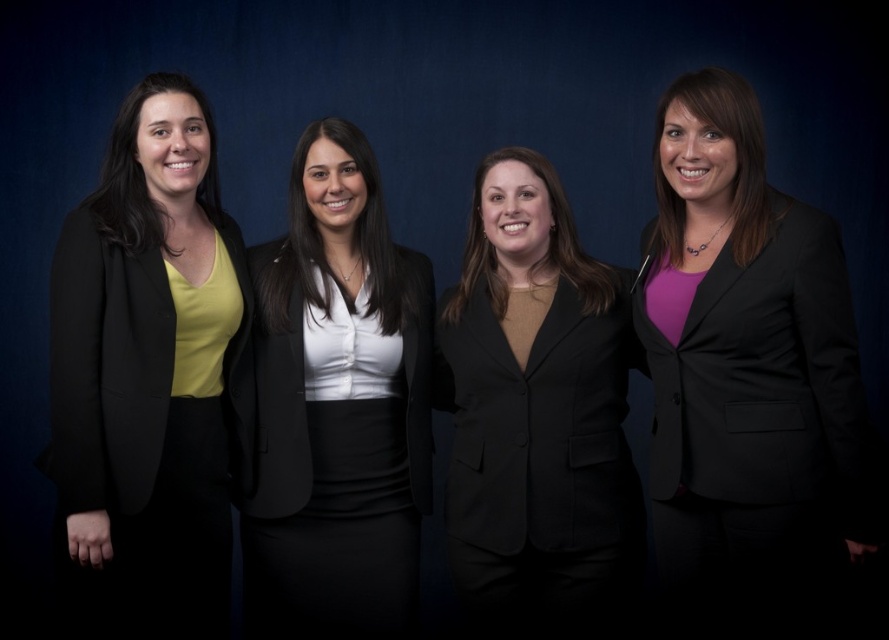
Locate an element on the screen. matte black blazer at left is located at coordinates (147, 378).

Can you confirm if matte black blazer at left is positioned above matte black blazer at center?

Yes.

Between point (162, 452) and point (255, 548), which one is positioned behind?

Point (255, 548)

Where is `matte black blazer at left`? The height and width of the screenshot is (640, 889). matte black blazer at left is located at coordinates (147, 378).

Is purple matte blazer at right shorter than black matte blazer at center?

In fact, purple matte blazer at right may be taller than black matte blazer at center.

Measure the distance between point (682, 328) and camera.

Point (682, 328) is 1.72 meters away from camera.

Locate an element on the screen. The width and height of the screenshot is (889, 640). purple matte blazer at right is located at coordinates (745, 378).

Between purple matte blazer at right and matte black blazer at left, which one is positioned higher?

purple matte blazer at right is above.

Who is positioned more to the left, purple matte blazer at right or matte black blazer at left?

Positioned to the left is matte black blazer at left.

Between point (666, 408) and point (141, 218), which one is positioned behind?

Positioned behind is point (141, 218).

Identify the location of purple matte blazer at right. The image size is (889, 640). (745, 378).